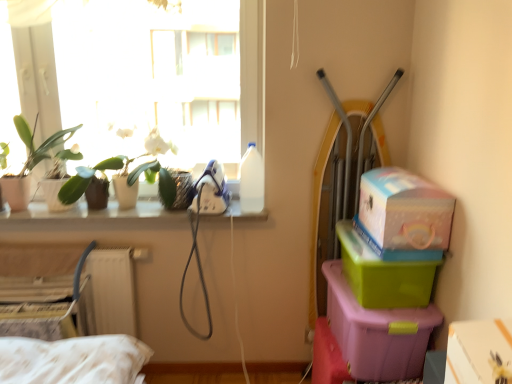
Question: Can you confirm if white cardboard box at lower right, which ranks as the fifth box in left-to-right order, is bigger than green plastic box at right, the second box viewed from the right?

Choices:
 (A) yes
 (B) no

Answer: (B)

Question: From the image's perspective, is white cardboard box at lower right, the 1th box in the right-to-left sequence, on top of green plastic box at right, placed as the 4th box when sorted from left to right?

Choices:
 (A) yes
 (B) no

Answer: (B)

Question: Can you confirm if white cardboard box at lower right, which ranks as the fifth box in left-to-right order, is taller than green plastic box at right, placed as the 4th box when sorted from left to right?

Choices:
 (A) no
 (B) yes

Answer: (A)

Question: Is white cardboard box at lower right, which ranks as the fifth box in left-to-right order, smaller than green plastic box at right, the second box viewed from the right?

Choices:
 (A) no
 (B) yes

Answer: (B)

Question: Considering the relative sizes of white cardboard box at lower right, the 1th box in the right-to-left sequence, and green plastic box at right, the second box viewed from the right, in the image provided, is white cardboard box at lower right, the 1th box in the right-to-left sequence, thinner than green plastic box at right, the second box viewed from the right,?

Choices:
 (A) yes
 (B) no

Answer: (A)

Question: From the image's perspective, is white cardboard box at lower left, acting as the first box starting from the left, above or below matte white pot at left?

Choices:
 (A) above
 (B) below

Answer: (B)

Question: Would you say white cardboard box at lower left, acting as the first box starting from the left, is to the left or to the right of matte white pot at left in the picture?

Choices:
 (A) left
 (B) right

Answer: (B)

Question: From their relative heights in the image, would you say white cardboard box at lower left, the 5th box in the right-to-left sequence, is taller or shorter than matte white pot at left?

Choices:
 (A) tall
 (B) short

Answer: (B)

Question: Is white cardboard box at lower left, the 5th box in the right-to-left sequence, inside the boundaries of matte white pot at left, or outside?

Choices:
 (A) inside
 (B) outside

Answer: (B)

Question: Is white matte orchid at upper left, the 1th plant from the right, wider or thinner than white cardboard box at lower right, the 1th box in the right-to-left sequence?

Choices:
 (A) thin
 (B) wide

Answer: (B)

Question: Does point (65, 196) appear closer or farther from the camera than point (486, 344)?

Choices:
 (A) farther
 (B) closer

Answer: (A)

Question: Is white matte orchid at upper left, the 1th plant from the right, situated inside white cardboard box at lower right, which ranks as the fifth box in left-to-right order, or outside?

Choices:
 (A) inside
 (B) outside

Answer: (B)

Question: In terms of height, does white matte orchid at upper left, which is the 2th plant in left-to-right order, look taller or shorter compared to white cardboard box at lower right, the 1th box in the right-to-left sequence?

Choices:
 (A) short
 (B) tall

Answer: (B)

Question: Is white cardboard box at lower right, which ranks as the fifth box in left-to-right order, in front of or behind white matte orchid at upper left, the 1th plant from the right, in the image?

Choices:
 (A) behind
 (B) front

Answer: (B)

Question: In terms of width, does white cardboard box at lower right, which ranks as the fifth box in left-to-right order, look wider or thinner when compared to white matte orchid at upper left, which is the 2th plant in left-to-right order?

Choices:
 (A) wide
 (B) thin

Answer: (B)